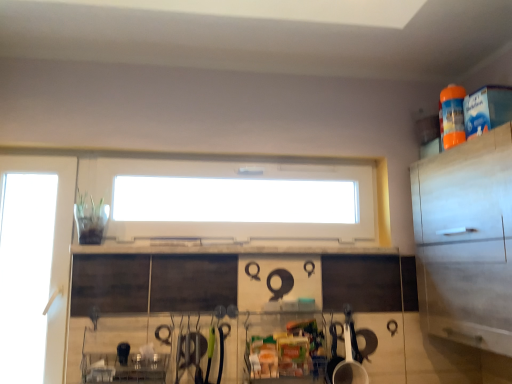
Question: Is the surface of transparent glass door at left in direct contact with white matte cabinet at right?

Choices:
 (A) yes
 (B) no

Answer: (B)

Question: Is transparent glass door at left not inside white matte cabinet at right?

Choices:
 (A) yes
 (B) no

Answer: (A)

Question: Considering the relative sizes of transparent glass door at left and white matte cabinet at right in the image provided, is transparent glass door at left wider than white matte cabinet at right?

Choices:
 (A) no
 (B) yes

Answer: (A)

Question: Is transparent glass door at left positioned before white matte cabinet at right?

Choices:
 (A) yes
 (B) no

Answer: (B)

Question: Is transparent glass door at left at the right side of white matte cabinet at right?

Choices:
 (A) yes
 (B) no

Answer: (B)

Question: Is transparent glass door at left to the left or to the right of white glossy cup at lower center in the image?

Choices:
 (A) right
 (B) left

Answer: (B)

Question: Looking at their shapes, would you say transparent glass door at left is wider or thinner than white glossy cup at lower center?

Choices:
 (A) wide
 (B) thin

Answer: (B)

Question: Is transparent glass door at left spatially inside white glossy cup at lower center, or outside of it?

Choices:
 (A) inside
 (B) outside

Answer: (B)

Question: Is point 47,235 closer or farther from the camera than point 347,337?

Choices:
 (A) closer
 (B) farther

Answer: (B)

Question: Is point (493, 183) positioned closer to the camera than point (193, 165)?

Choices:
 (A) farther
 (B) closer

Answer: (B)

Question: Is white matte cabinet at right spatially inside white plastic window at center, or outside of it?

Choices:
 (A) inside
 (B) outside

Answer: (B)

Question: From a real-world perspective, is white matte cabinet at right physically located above or below white plastic window at center?

Choices:
 (A) below
 (B) above

Answer: (A)

Question: From the image's perspective, is white matte cabinet at right positioned above or below white plastic window at center?

Choices:
 (A) below
 (B) above

Answer: (A)

Question: Looking at their shapes, would you say white glossy cup at lower center is wider or thinner than white matte cabinet at right?

Choices:
 (A) thin
 (B) wide

Answer: (A)

Question: From the image's perspective, is white glossy cup at lower center located above or below white matte cabinet at right?

Choices:
 (A) above
 (B) below

Answer: (B)